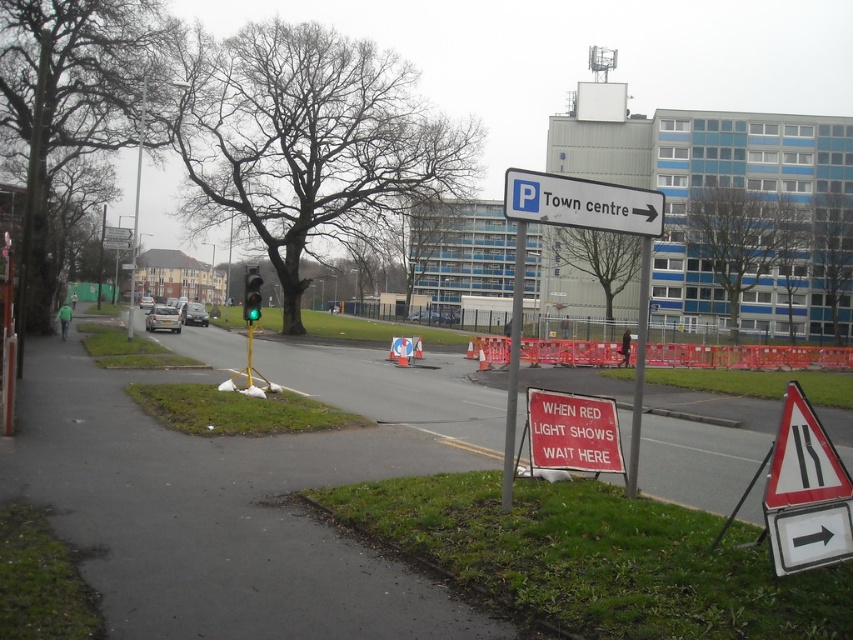
How much distance is there between gray metallic pole at center and green glass traffic light at center?

gray metallic pole at center is 11.39 meters from green glass traffic light at center.

Describe the element at coordinates (514, 365) in the screenshot. I see `gray metallic pole at center` at that location.

Is point (503, 483) in front of point (245, 276)?

Yes, it is in front of point (245, 276).

I want to click on gray metallic pole at center, so click(x=514, y=365).

Can you confirm if red matte sign at lower center is smaller than green glass traffic light at center?

Yes.

Based on the photo, who is positioned more to the left, red matte sign at lower center or green glass traffic light at center?

green glass traffic light at center is more to the left.

What do you see at coordinates (572, 433) in the screenshot? This screenshot has height=640, width=853. I see `red matte sign at lower center` at bounding box center [572, 433].

I want to click on red matte sign at lower center, so [572, 433].

Does white plastic sign at upper center appear on the right side of red matte sign at lower center?

Indeed, white plastic sign at upper center is positioned on the right side of red matte sign at lower center.

Between point (640, 214) and point (578, 404), which one is positioned behind?

The point (578, 404) is behind.

Is point (554, 205) positioned in front of point (540, 412)?

Yes.

I want to click on white plastic sign at upper center, so click(x=581, y=204).